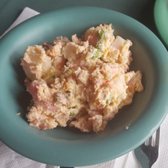
Where is `bowl]`? The width and height of the screenshot is (168, 168). bowl] is located at coordinates (152, 96).